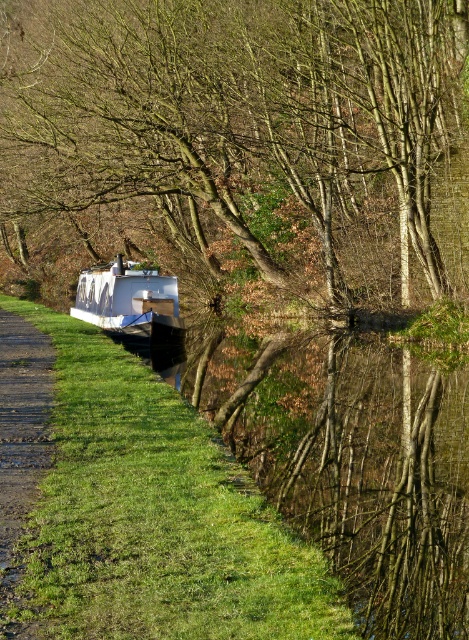
You are a hiker who wants to reach the white matte boat at center from the gravel path at lower left. Can you walk directly to the boat from the path without crossing any obstacles?

The gravel path at lower left is in front of the white matte boat at center, so you can walk directly to the boat from the path without crossing any obstacles.

You are standing at the origin point of the image. Which direction should you move to reach the green grass at lower left?

The green grass at lower left is located at coordinate point (156, 516), so you should move towards the lower left direction to reach it.

Consider the image. You are standing at the center of the image and want to walk to the gravel path at lower left. Which direction should you move in to reach it?

To reach the gravel path at lower left, you should move towards the lower left direction from the center of the image.